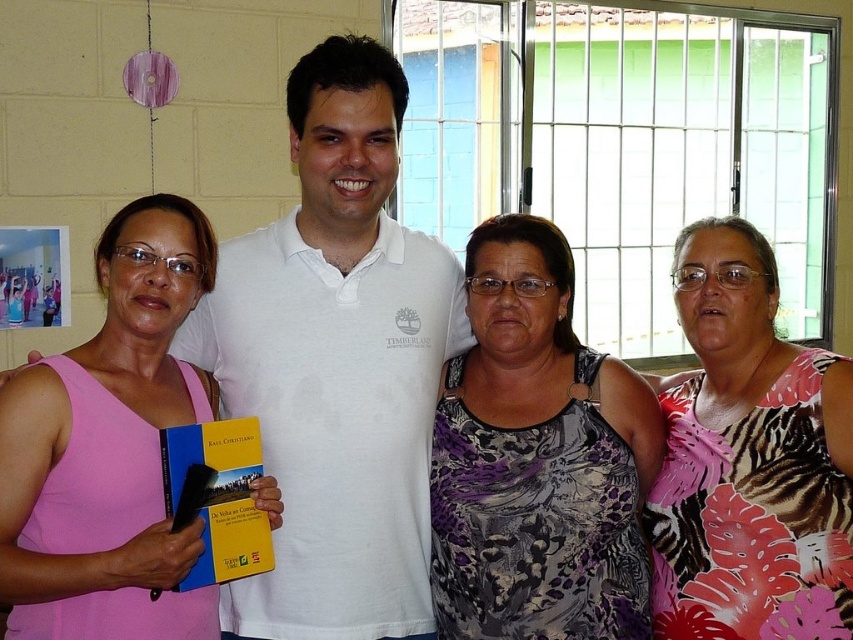
You are standing in the room and want to see the window outside. Which of the two people, the white cotton shirt at center or the pink floral dress at center, is closer to you?

The white cotton shirt at center is closer to you because the pink floral dress at center is behind it.

You are standing in the room and want to hand a document to the person wearing the white cotton shirt at center. Which direction should you move to reach them?

The white cotton shirt at center is located at point (x=335, y=355), so you should move towards the center of the room to reach them.